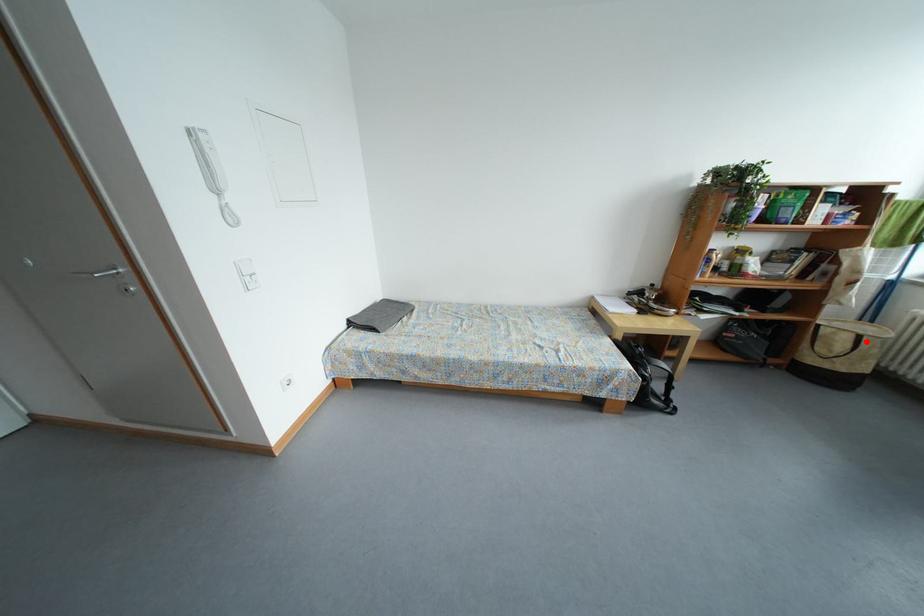
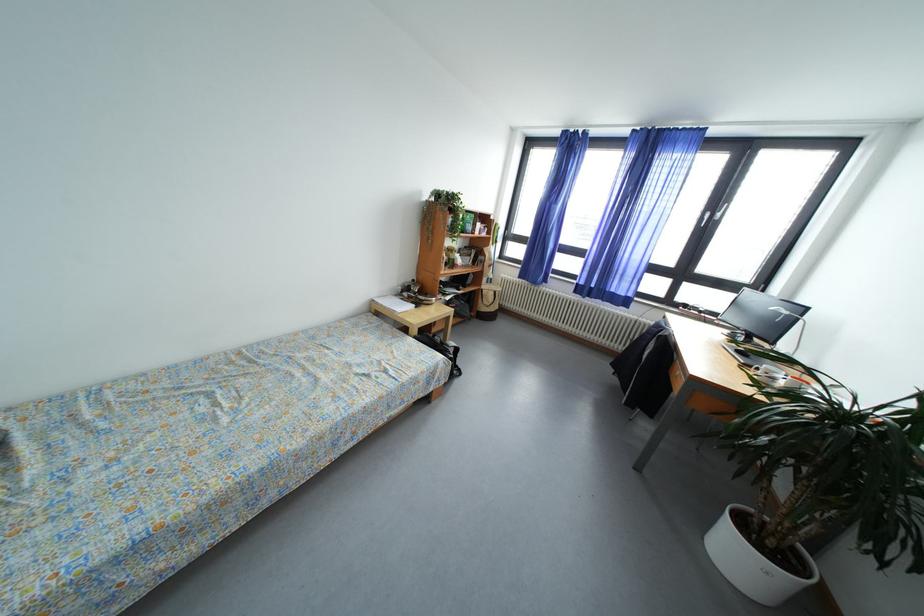
Question: I am providing you with two images of the same scene from different viewpoints. Image1 has a red point marked. In image2, the corresponding 3D location appears at what relative position? Reply with the corresponding letter.

Choices:
 (A) Closer
 (B) Farther

Answer: (A)